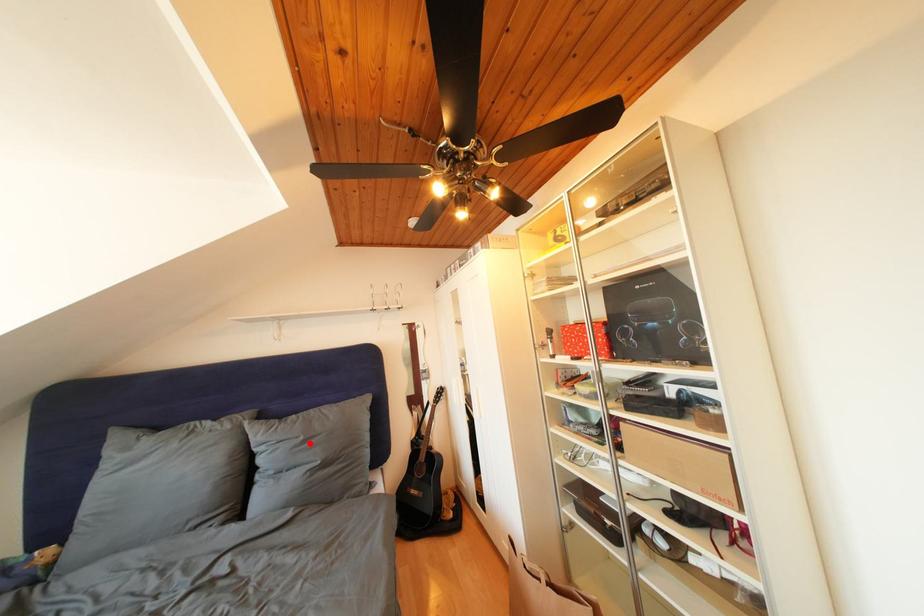
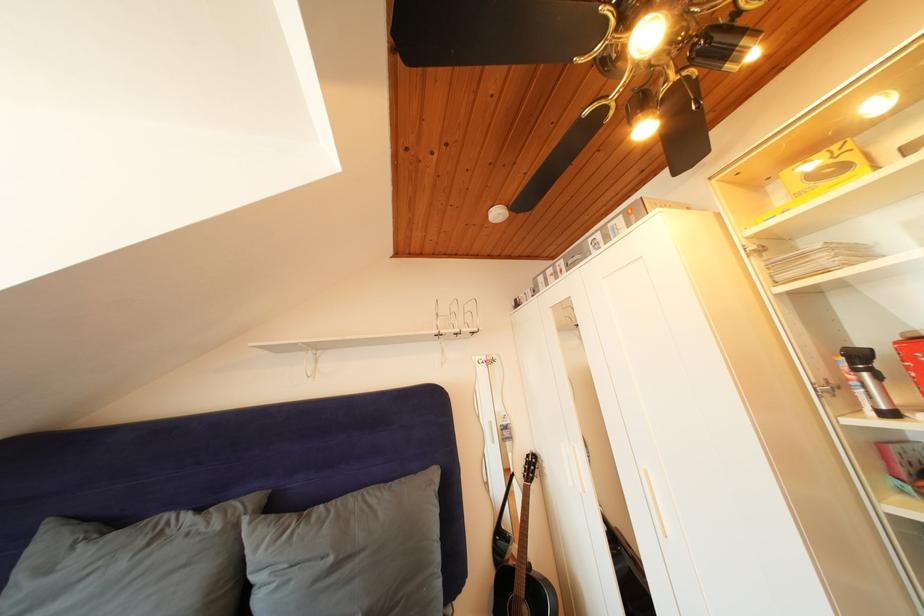
Where in the second image is the point corresponding to the highlighted location from the first image?

(338, 565)